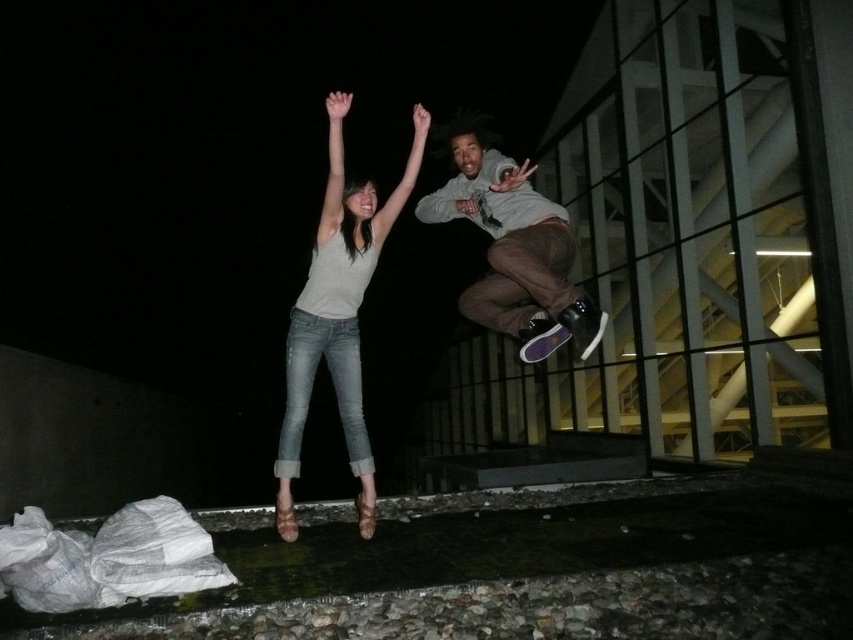
Can you confirm if matte gray shirt at center is taller than matte gray hoodie at center?

Yes, matte gray shirt at center is taller than matte gray hoodie at center.

Does point (341, 150) lie in front of point (486, 202)?

That is True.

Find the location of a particular element. This screenshot has height=640, width=853. matte gray shirt at center is located at coordinates (338, 312).

Can you confirm if denim jeans at center is bigger than matte gray hoodie at center?

No.

Which of these two, denim jeans at center or matte gray hoodie at center, stands shorter?

matte gray hoodie at center

Image resolution: width=853 pixels, height=640 pixels. I want to click on denim jeans at center, so click(x=338, y=312).

How much distance is there between matte gray shirt at center and denim jeans at center?

matte gray shirt at center and denim jeans at center are 6.24 inches apart.

Does matte gray shirt at center have a greater height compared to denim jeans at center?

Incorrect, matte gray shirt at center's height is not larger of denim jeans at center's.

What are the coordinates of `matte gray shirt at center` in the screenshot? It's located at (338, 312).

This screenshot has width=853, height=640. In order to click on matte gray shirt at center in this screenshot , I will do `click(338, 312)`.